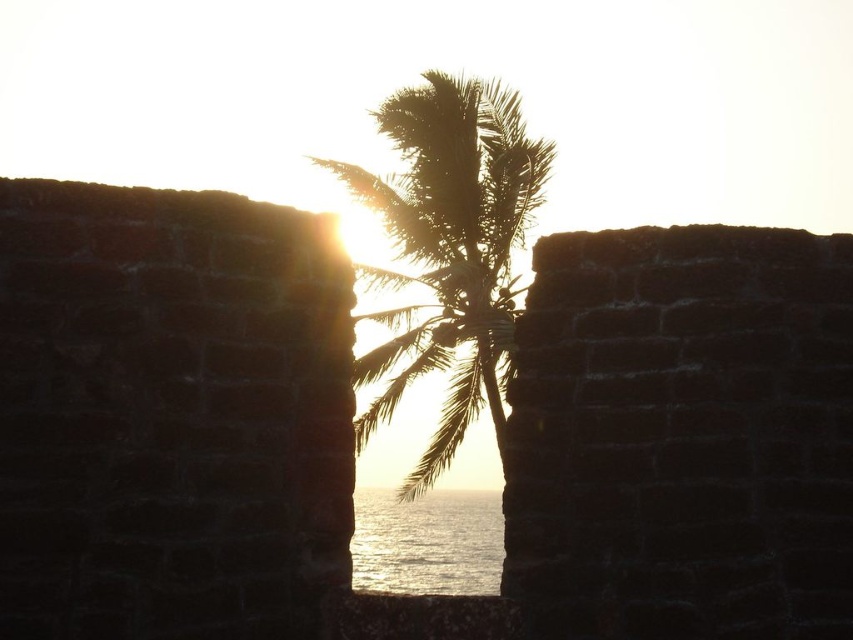
Question: Is silhouette leafy palm at center wider than shiny silver water at center?

Choices:
 (A) no
 (B) yes

Answer: (A)

Question: Among these objects, which one is nearest to the camera?

Choices:
 (A) silhouette leafy palm at center
 (B) shiny silver water at center

Answer: (A)

Question: Can you confirm if silhouette leafy palm at center is smaller than shiny silver water at center?

Choices:
 (A) no
 (B) yes

Answer: (B)

Question: Is silhouette leafy palm at center wider than shiny silver water at center?

Choices:
 (A) yes
 (B) no

Answer: (B)

Question: Which point is closer to the camera?

Choices:
 (A) shiny silver water at center
 (B) silhouette leafy palm at center

Answer: (B)